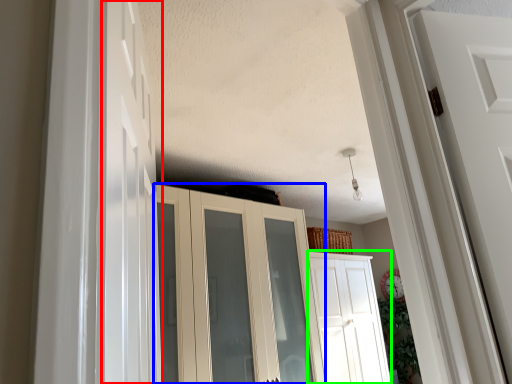
Question: Which object is the farthest from door (highlighted by a red box)? Choose among these: cupboard (highlighted by a blue box) or door (highlighted by a green box).

Choices:
 (A) cupboard
 (B) door

Answer: (B)